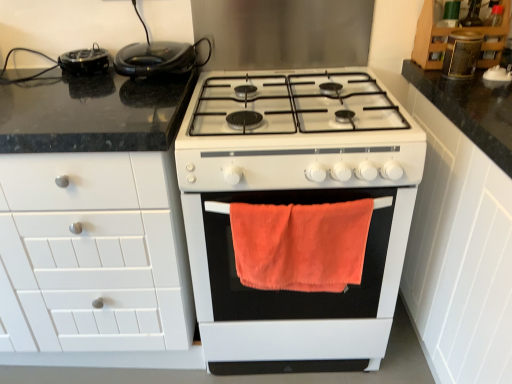
Question: From the image's perspective, is white matte gas stove at center, which ranks as the first appliance in bottom-to-top order, located beneath wooden cabinet at upper right, acting as the second cabinetry starting from the right?

Choices:
 (A) yes
 (B) no

Answer: (A)

Question: Does white matte gas stove at center, positioned as the third appliance in top-to-bottom order, have a greater width compared to wooden cabinet at upper right, the second cabinetry viewed from the left?

Choices:
 (A) no
 (B) yes

Answer: (B)

Question: Does white matte gas stove at center, positioned as the third appliance in top-to-bottom order, have a lesser width compared to wooden cabinet at upper right, the second cabinetry viewed from the left?

Choices:
 (A) no
 (B) yes

Answer: (A)

Question: Is white matte gas stove at center, placed as the second appliance when sorted from right to left, bigger than wooden cabinet at upper right, the second cabinetry viewed from the left?

Choices:
 (A) no
 (B) yes

Answer: (B)

Question: Is the depth of white matte gas stove at center, positioned as the third appliance in top-to-bottom order, less than that of wooden cabinet at upper right, the second cabinetry viewed from the left?

Choices:
 (A) no
 (B) yes

Answer: (B)

Question: Is white matte gas stove at center, placed as the second appliance when sorted from right to left, aimed at wooden cabinet at upper right, the second cabinetry viewed from the left?

Choices:
 (A) yes
 (B) no

Answer: (B)

Question: From the image's perspective, would you say orange fuzzy towel at center is shown under wooden cabinet at upper right, the second cabinetry viewed from the left?

Choices:
 (A) yes
 (B) no

Answer: (A)

Question: From a real-world perspective, is orange fuzzy towel at center on wooden cabinet at upper right, acting as the second cabinetry starting from the right?

Choices:
 (A) yes
 (B) no

Answer: (B)

Question: Is orange fuzzy towel at center shorter than wooden cabinet at upper right, the second cabinetry viewed from the left?

Choices:
 (A) yes
 (B) no

Answer: (B)

Question: From the image's perspective, is orange fuzzy towel at center on wooden cabinet at upper right, the second cabinetry viewed from the left?

Choices:
 (A) yes
 (B) no

Answer: (B)

Question: Considering the relative sizes of orange fuzzy towel at center and wooden cabinet at upper right, the second cabinetry viewed from the left, in the image provided, is orange fuzzy towel at center bigger than wooden cabinet at upper right, the second cabinetry viewed from the left,?

Choices:
 (A) yes
 (B) no

Answer: (B)

Question: Is orange fuzzy towel at center turned away from wooden cabinet at upper right, the second cabinetry viewed from the left?

Choices:
 (A) yes
 (B) no

Answer: (B)

Question: From a real-world perspective, is white matte cabinet at right, which ranks as the first cabinetry in right-to-left order, on orange fuzzy towel at center?

Choices:
 (A) yes
 (B) no

Answer: (B)